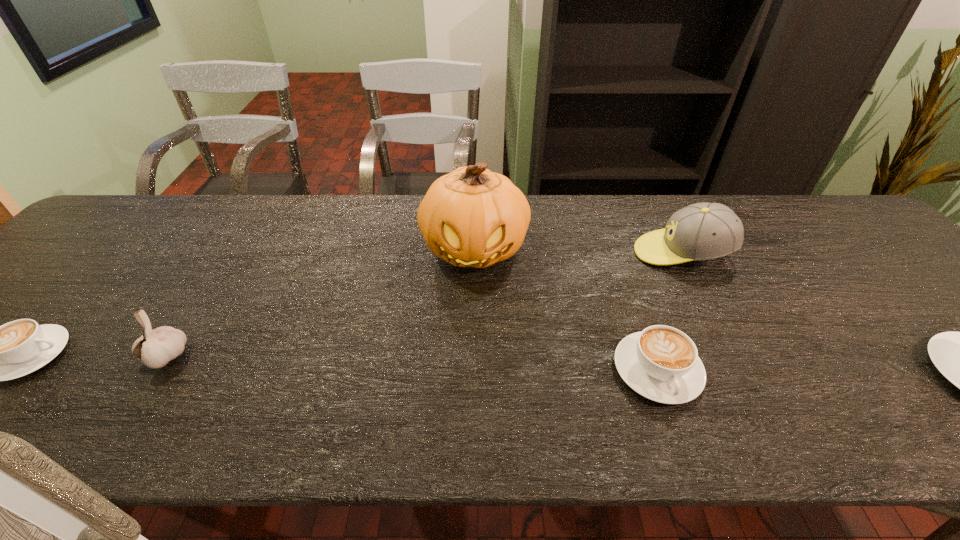
The height and width of the screenshot is (540, 960). Identify the location of the second cappuccino from right to left. (661, 363).

In order to click on the fifth tallest object in this screenshot , I will do `click(661, 363)`.

Find the location of a particular element. This screenshot has height=540, width=960. the fourth object from right to left is located at coordinates (472, 217).

At what (x,y) coordinates should I click in order to perform the action: click on the tallest object. Please return your answer as a coordinate pair (x, y). The height and width of the screenshot is (540, 960). Looking at the image, I should click on (472, 217).

The height and width of the screenshot is (540, 960). Identify the location of garlic. (156, 347).

Where is `the third tallest object`? Image resolution: width=960 pixels, height=540 pixels. the third tallest object is located at coordinates point(156,347).

Locate an element on the screen. baseball cap is located at coordinates (703, 231).

This screenshot has width=960, height=540. In order to click on free space located on the front face of the fourth object from right to left in this screenshot , I will do pos(474,306).

You are a GUI agent. You are given a task and a screenshot of the screen. Output one action in this format:
    pyautogui.click(x=<x>, y=<y>)
    Task: Click on the free spot located 0.180m on the back of the fourth shortest object
    
    Given the screenshot: What is the action you would take?
    pyautogui.click(x=214, y=282)

Find the location of `blank area located on the front-facing side of the fifth shortest object`. blank area located on the front-facing side of the fifth shortest object is located at coordinates coord(509,253).